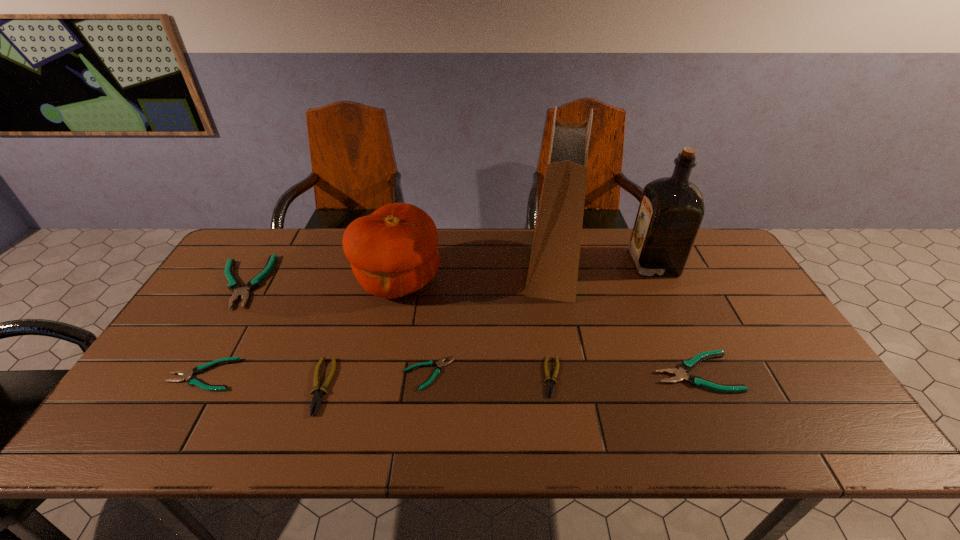
Identify the location of free area in between the bigger yellow pliers and the rightmost pliers. (508, 379).

Identify the location of blank region between the right yellow pliers and the farthest pliers. (396, 329).

I want to click on vacant region between the smaller yellow pliers and the bigger yellow pliers, so click(437, 382).

Identify the location of vacant space in between the smallest teal pliers and the third tallest object. (414, 326).

This screenshot has width=960, height=540. What are the coordinates of `free spot between the right yellow pliers and the third pliers from left to right` in the screenshot? It's located at (437, 382).

Image resolution: width=960 pixels, height=540 pixels. Identify the location of vacant space in between the sixth shortest object and the third smallest teal pliers. (468, 327).

Select which object is the third closest to the second smallest teal pliers. Please provide its 2D coordinates. Your answer should be formatted as a tuple, i.e. [(x, y)], where the tuple contains the x and y coordinates of a point satisfying the conditions above.

[(393, 252)]

This screenshot has height=540, width=960. In order to click on object that ranks as the closest to the right yellow pliers in this screenshot , I will do `click(553, 270)`.

Point out which pliers is positioned as the third nearest to the third smallest teal pliers. Please provide its 2D coordinates. Your answer should be formatted as a tuple, i.e. [(x, y)], where the tuple contains the x and y coordinates of a point satisfying the conditions above.

[(317, 397)]

You are a GUI agent. You are given a task and a screenshot of the screen. Output one action in this format:
    pyautogui.click(x=<x>, y=<y>)
    Task: Click on the pliers that is the second closest to the fifth pliers from left to right
    This screenshot has height=540, width=960.
    Given the screenshot: What is the action you would take?
    pyautogui.click(x=680, y=374)